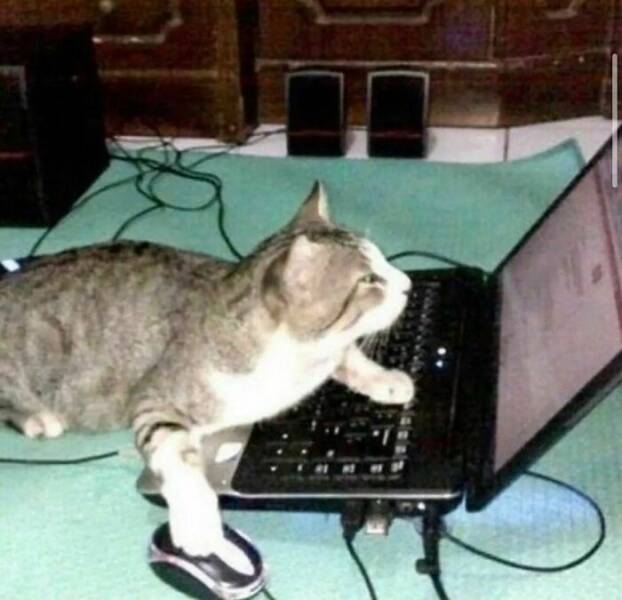
Image resolution: width=622 pixels, height=600 pixels. Identify the location of laptop lights. (443, 346), (440, 364).